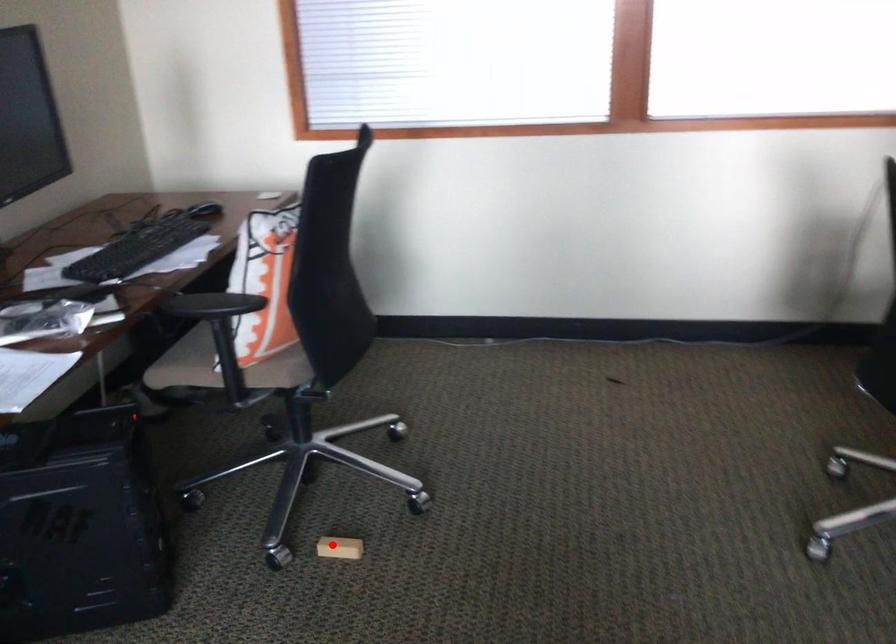
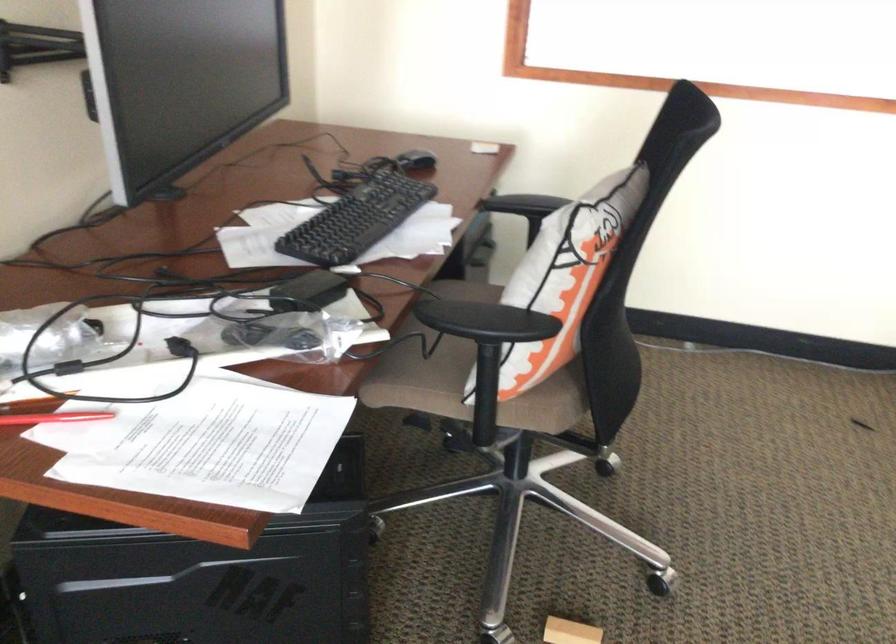
Question: I am providing you with two images of the same scene from different viewpoints. A red point is shown in image1. For the corresponding object point in image2, is it positioned nearer or farther from the camera?

Choices:
 (A) Nearer
 (B) Farther

Answer: (A)